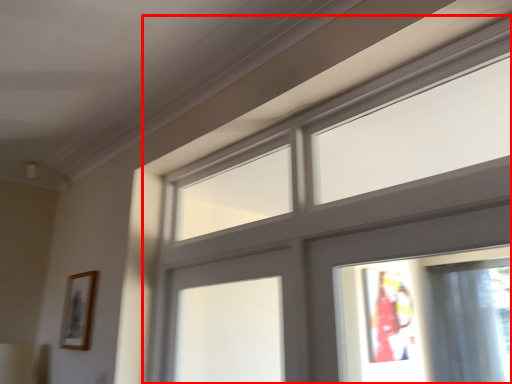
Question: From the image's perspective, where is window (annotated by the red box) located in relation to picture frame in the image?

Choices:
 (A) below
 (B) above

Answer: (B)